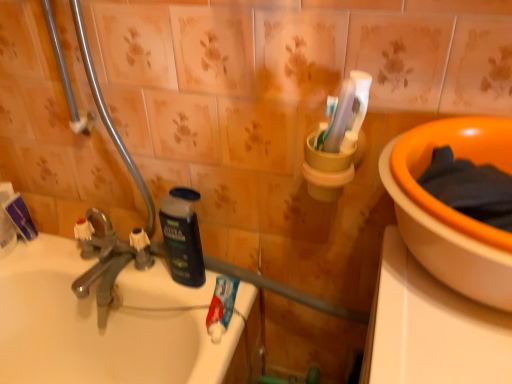
Locate an element on the screen. This screenshot has width=512, height=384. black matte bottle at center is located at coordinates (182, 236).

Measure the distance between orange ceramic basin at upper right and camera.

They are 16.45 inches apart.

From the picture: Measure the distance between point (223, 278) and camera.

36.57 inches.

I want to click on black matte bottle at center, so click(182, 236).

Between white matte toothpaste at upper left, which is counted as the 2th toothpaste, starting from the right, and black matte bottle at center, which one has less height?

Standing shorter between the two is white matte toothpaste at upper left, which is counted as the 2th toothpaste, starting from the right.

Based on their positions, is white matte toothpaste at upper left, the first toothpaste when ordered from back to front, located to the left or right of black matte bottle at center?

white matte toothpaste at upper left, the first toothpaste when ordered from back to front, is to the left of black matte bottle at center.

Find the location of a particular element. Image resolution: width=512 pixels, height=384 pixels. toothpaste behind the black matte bottle at center is located at coordinates (17, 211).

From the image's perspective, who appears lower, white matte toothpaste at upper left, which ranks as the second toothpaste in front-to-back order, or black matte bottle at center?

black matte bottle at center appears lower in the image.

Is blue matte toothpaste at sink, which is the second toothpaste from left to right, located within black matte bottle at center?

No, blue matte toothpaste at sink, which is the second toothpaste from left to right, is not a part of black matte bottle at center.

Is black matte bottle at center further to the viewer compared to blue matte toothpaste at sink, positioned as the second toothpaste in top-to-bottom order?

Yes, it is behind blue matte toothpaste at sink, positioned as the second toothpaste in top-to-bottom order.

Which of these two, black matte bottle at center or blue matte toothpaste at sink, positioned as the second toothpaste in top-to-bottom order, stands shorter?

blue matte toothpaste at sink, positioned as the second toothpaste in top-to-bottom order.

From the image's perspective, is black matte bottle at center below blue matte toothpaste at sink, which ranks as the first toothpaste in right-to-left order?

No, from the image's perspective, black matte bottle at center is not beneath blue matte toothpaste at sink, which ranks as the first toothpaste in right-to-left order.

Could you tell me if orange ceramic basin at upper right is facing black matte bottle at center?

No, orange ceramic basin at upper right does not turn towards black matte bottle at center.

Between orange ceramic basin at upper right and black matte bottle at center, which one has smaller width?

black matte bottle at center is thinner.

Is orange ceramic basin at upper right positioned before black matte bottle at center?

Yes.

From a real-world perspective, is orange ceramic basin at upper right physically located above or below black matte bottle at center?

orange ceramic basin at upper right is situated higher than black matte bottle at center in the real world.

Which is more to the left, white matte toothpaste at upper left, which is the second toothpaste from bottom to top, or blue matte toothpaste at sink, which is the second toothpaste from left to right?

From the viewer's perspective, white matte toothpaste at upper left, which is the second toothpaste from bottom to top, appears more on the left side.

Find the location of a particular element. This screenshot has width=512, height=384. toothpaste behind the blue matte toothpaste at sink, which is the second toothpaste from left to right is located at coordinates (17, 211).

Which object is thinner, white matte toothpaste at upper left, which is counted as the 2th toothpaste, starting from the right, or blue matte toothpaste at sink, the 2th toothpaste when ordered from back to front?

white matte toothpaste at upper left, which is counted as the 2th toothpaste, starting from the right, is thinner.

Where is `bottle lying behind the blue matte toothpaste at sink, which ranks as the first toothpaste in front-to-back order`? The image size is (512, 384). bottle lying behind the blue matte toothpaste at sink, which ranks as the first toothpaste in front-to-back order is located at coordinates (182, 236).

Is blue matte toothpaste at sink, which ranks as the first toothpaste in front-to-back order, smaller than black matte bottle at center?

Yes.

Consider the image. Can you confirm if blue matte toothpaste at sink, which is the second toothpaste from left to right, is taller than black matte bottle at center?

In fact, blue matte toothpaste at sink, which is the second toothpaste from left to right, may be shorter than black matte bottle at center.

Considering the sizes of objects blue matte toothpaste at sink, positioned as the second toothpaste in top-to-bottom order, and black matte bottle at center in the image provided, who is wider, blue matte toothpaste at sink, positioned as the second toothpaste in top-to-bottom order, or black matte bottle at center?

blue matte toothpaste at sink, positioned as the second toothpaste in top-to-bottom order, is wider.

In terms of size, does white matte toothpaste at upper left, which is counted as the first toothpaste, starting from the left, appear bigger or smaller than orange ceramic basin at upper right?

Considering their sizes, white matte toothpaste at upper left, which is counted as the first toothpaste, starting from the left, takes up less space than orange ceramic basin at upper right.

From a real-world perspective, between white matte toothpaste at upper left, which ranks as the second toothpaste in front-to-back order, and orange ceramic basin at upper right, who is vertically higher?

From a 3D spatial view, orange ceramic basin at upper right is above.

Is white matte toothpaste at upper left, which is counted as the 2th toothpaste, starting from the right, in contact with orange ceramic basin at upper right?

white matte toothpaste at upper left, which is counted as the 2th toothpaste, starting from the right, and orange ceramic basin at upper right are clearly separated.

Looking at this image, is orange ceramic basin at upper right inside white matte toothpaste at upper left, which is counted as the first toothpaste, starting from the left?

No.

From a real-world perspective, is black matte bottle at center under white matte toothpaste at upper left, which ranks as the second toothpaste in front-to-back order?

No, from a real-world perspective, black matte bottle at center is not beneath white matte toothpaste at upper left, which ranks as the second toothpaste in front-to-back order.

From the image's perspective, is black matte bottle at center below white matte toothpaste at upper left, which ranks as the second toothpaste in front-to-back order?

Yes, from the image's perspective, black matte bottle at center is beneath white matte toothpaste at upper left, which ranks as the second toothpaste in front-to-back order.

Which object is thinner, black matte bottle at center or white matte toothpaste at upper left, the 1th toothpaste viewed from the top?

With smaller width is white matte toothpaste at upper left, the 1th toothpaste viewed from the top.

Relative to white matte toothpaste at upper left, which is counted as the 2th toothpaste, starting from the right, is black matte bottle at center in front or behind?

Clearly, black matte bottle at center is in front of white matte toothpaste at upper left, which is counted as the 2th toothpaste, starting from the right.

From a real-world perspective, which toothpaste is the 1st one underneath the black matte bottle at center? Please provide its 2D coordinates.

[(17, 211)]

Where is `bottle above the blue matte toothpaste at sink, the 1th toothpaste positioned from the bottom (from the image's perspective)`? bottle above the blue matte toothpaste at sink, the 1th toothpaste positioned from the bottom (from the image's perspective) is located at coordinates (182, 236).

Which object lies further to the anchor point black matte bottle at center, chrome metallic faucet at left or white matte toothpaste at upper left, the first toothpaste when ordered from back to front?

white matte toothpaste at upper left, the first toothpaste when ordered from back to front, is further to black matte bottle at center.

From the image, which object appears to be farther from black matte bottle at center, blue matte toothpaste at sink, which ranks as the first toothpaste in front-to-back order, or chrome metallic faucet at left?

chrome metallic faucet at left is positioned further to the anchor black matte bottle at center.

Estimate the real-world distances between objects in this image. Which object is further from chrome metallic faucet at left, blue matte toothpaste at sink, the 2th toothpaste when ordered from back to front, or white matte toothpaste at upper left, the 1th toothpaste viewed from the top?

Based on the image, blue matte toothpaste at sink, the 2th toothpaste when ordered from back to front, appears to be further to chrome metallic faucet at left.

Considering their positions, is blue matte toothpaste at sink, positioned as the second toothpaste in top-to-bottom order, positioned further to chrome metallic faucet at left than black matte bottle at center?

blue matte toothpaste at sink, positioned as the second toothpaste in top-to-bottom order, is further to chrome metallic faucet at left.

Looking at the image, which one is located further to blue matte toothpaste at sink, which ranks as the first toothpaste in right-to-left order, black matte bottle at center or orange ceramic basin at upper right?

Based on the image, orange ceramic basin at upper right appears to be further to blue matte toothpaste at sink, which ranks as the first toothpaste in right-to-left order.

Based on their spatial positions, is black matte bottle at center or white matte toothpaste at upper left, which ranks as the second toothpaste in front-to-back order, closer to orange ceramic basin at upper right?

The object closer to orange ceramic basin at upper right is black matte bottle at center.

When comparing their distances from white matte toothpaste at upper left, which is counted as the first toothpaste, starting from the left, does blue matte toothpaste at sink, which is the second toothpaste from left to right, or chrome metallic faucet at left seem closer?

Among the two, chrome metallic faucet at left is located nearer to white matte toothpaste at upper left, which is counted as the first toothpaste, starting from the left.

Estimate the real-world distances between objects in this image. Which object is closer to blue matte toothpaste at sink, the 1th toothpaste positioned from the bottom, white matte toothpaste at upper left, the first toothpaste when ordered from back to front, or black matte bottle at center?

black matte bottle at center is positioned closer to the anchor blue matte toothpaste at sink, the 1th toothpaste positioned from the bottom.

Locate an element on the screen. bottle between white matte toothpaste at upper left, which ranks as the second toothpaste in front-to-back order, and blue matte toothpaste at sink, which ranks as the first toothpaste in front-to-back order is located at coordinates (182, 236).

The height and width of the screenshot is (384, 512). I want to click on bottle located between white matte toothpaste at upper left, the 1th toothpaste viewed from the top, and orange ceramic basin at upper right in the left-right direction, so click(182, 236).

Locate an element on the screen. The width and height of the screenshot is (512, 384). toothpaste located between white matte toothpaste at upper left, which is counted as the 2th toothpaste, starting from the right, and orange ceramic basin at upper right in the left-right direction is located at coordinates (221, 307).

Identify the location of bottle between chrome metallic faucet at left and orange ceramic basin at upper right in the horizontal direction. (182, 236).